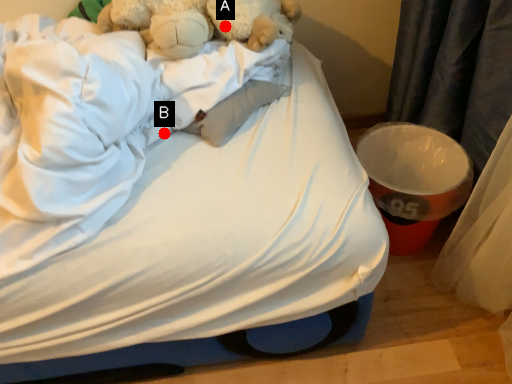
Question: Two points are circled on the image, labeled by A and B beside each circle. Which point is farther to the camera?

Choices:
 (A) A is further
 (B) B is further

Answer: (A)